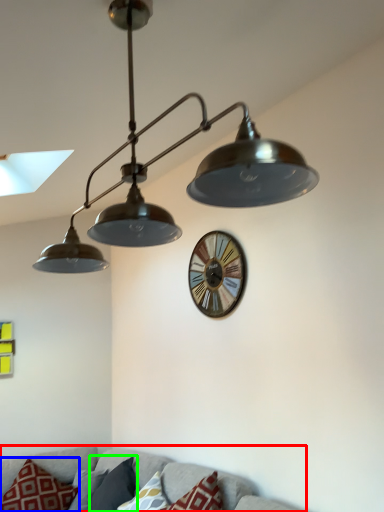
Question: Based on their relative distances, which object is nearer to couch (highlighted by a red box)? Choose from pillow (highlighted by a blue box) and pillow (highlighted by a green box).

Choices:
 (A) pillow
 (B) pillow

Answer: (B)